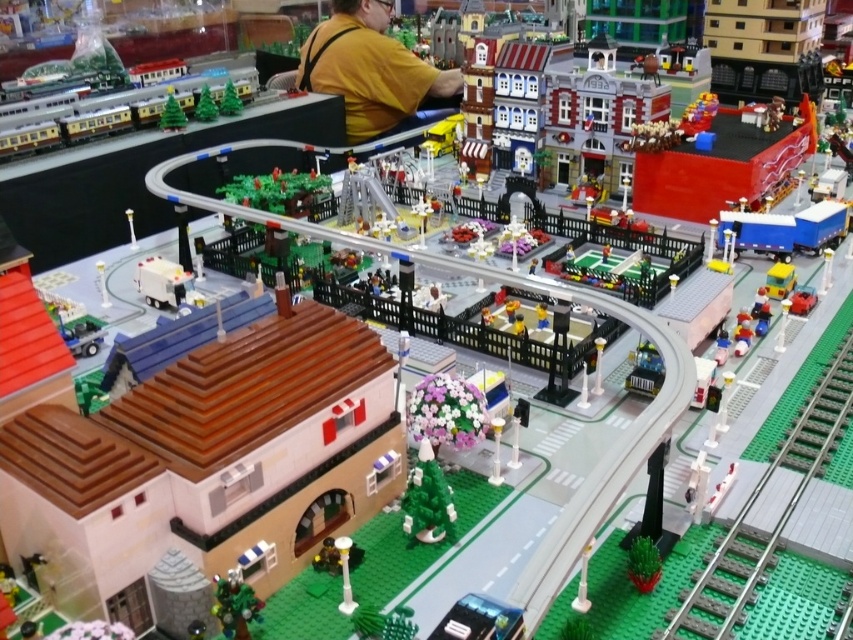
You are a toy collector who wants to display both the green plastic train track at lower right and the green matte christmas tree at upper left on a shelf. Which one should you place first to ensure they both fit?

The green plastic train track at lower right is larger in size than the green matte christmas tree at upper left, so you should place the green plastic train track at lower right first to ensure there is enough space for both items.